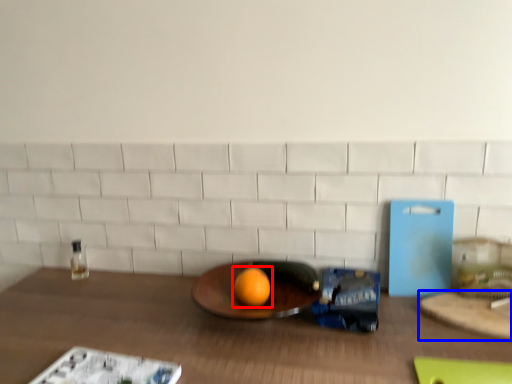
Question: Among these objects, which one is nearest to the camera, grapefruit (highlighted by a red box) or cutting board (highlighted by a blue box)?

Choices:
 (A) grapefruit
 (B) cutting board

Answer: (B)